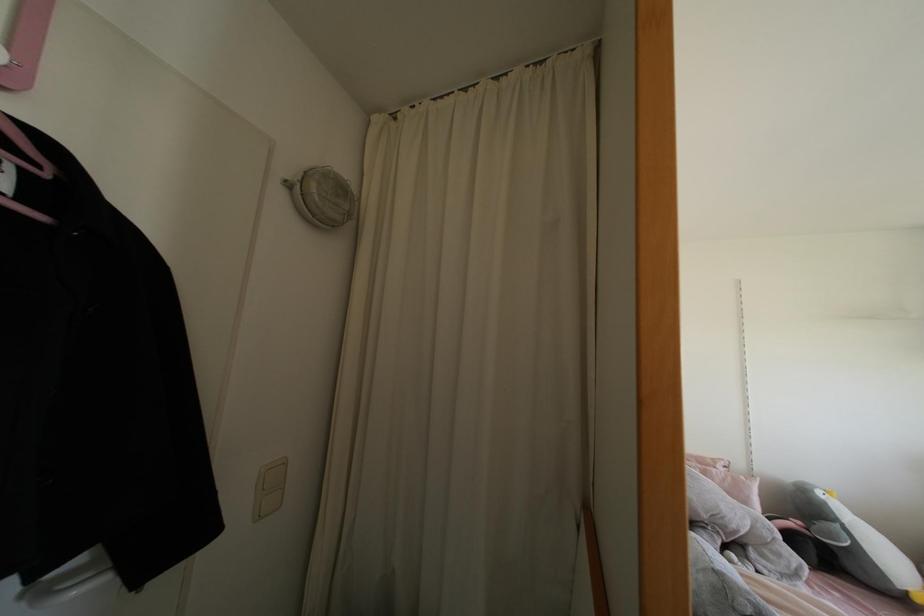
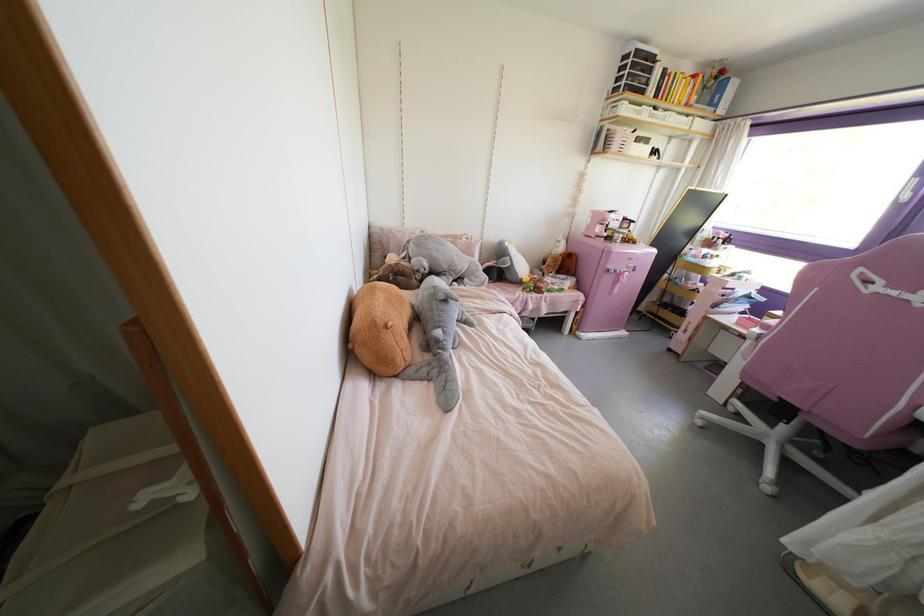
Based on the continuous images, in which direction is the camera rotating?

The camera's rotation is toward right-down.